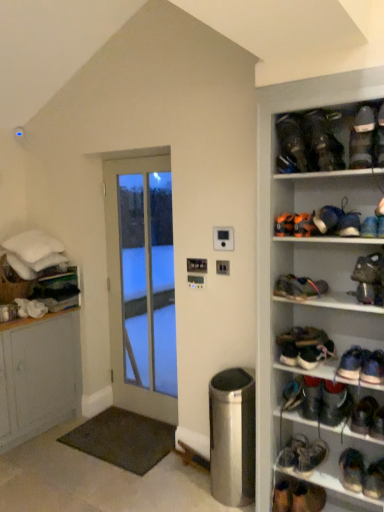
Find the location of a particular element. Image resolution: width=384 pixels, height=512 pixels. white soft cushion at left is located at coordinates (33, 246).

What do you see at coordinates (123, 439) in the screenshot? The width and height of the screenshot is (384, 512). I see `brown textured mat at lower left` at bounding box center [123, 439].

Where is `dark brown leather shoe at lower right, which is counted as the 20th footwear, starting from the top`? This screenshot has width=384, height=512. dark brown leather shoe at lower right, which is counted as the 20th footwear, starting from the top is located at coordinates (308, 498).

Is dark brown leather shoe at lower right, which is the 8th footwear in bottom-to-top order, located outside dark blue suede shoe at lower right, the 4th footwear when ordered from bottom to top?

dark brown leather shoe at lower right, which is the 8th footwear in bottom-to-top order, is positioned outside dark blue suede shoe at lower right, the 4th footwear when ordered from bottom to top.

From a real-world perspective, is dark brown leather shoe at lower right, which is counted as the 13th footwear, starting from the top, over dark blue suede shoe at lower right, the 4th footwear when ordered from bottom to top?

Yes, from a real-world perspective, dark brown leather shoe at lower right, which is counted as the 13th footwear, starting from the top, is on top of dark blue suede shoe at lower right, the 4th footwear when ordered from bottom to top.

Is dark brown leather shoe at lower right, which is the 8th footwear in bottom-to-top order, at the left side of dark blue suede shoe at lower right, which is the seventeenth footwear from top to bottom?

Indeed, dark brown leather shoe at lower right, which is the 8th footwear in bottom-to-top order, is positioned on the left side of dark blue suede shoe at lower right, which is the seventeenth footwear from top to bottom.

Where is `the 4th footwear in front when counting from the silver metallic trash can at center-right`? the 4th footwear in front when counting from the silver metallic trash can at center-right is located at coordinates (284, 225).

In the scene shown: From the image's perspective, is silver metallic trash can at center-right on orange suede shoe at upper right, acting as the seventeenth footwear starting from the bottom?

Incorrect, from the image's perspective, silver metallic trash can at center-right is lower than orange suede shoe at upper right, acting as the seventeenth footwear starting from the bottom.

From a real-world perspective, is silver metallic trash can at center-right beneath orange suede shoe at upper right, acting as the seventeenth footwear starting from the bottom?

Yes, from a real-world perspective, silver metallic trash can at center-right is beneath orange suede shoe at upper right, acting as the seventeenth footwear starting from the bottom.

From the image's perspective, is shiny metallic shoe at upper right, acting as the tenth footwear starting from the top, above or below shiny black shoe at lower right, the fifteenth footwear in the top-to-bottom sequence?

Clearly, from the image's perspective, shiny metallic shoe at upper right, acting as the tenth footwear starting from the top, is above shiny black shoe at lower right, the fifteenth footwear in the top-to-bottom sequence.

From a real-world perspective, is shiny metallic shoe at upper right, the eleventh footwear positioned from the bottom, physically below shiny black shoe at lower right, the fifteenth footwear in the top-to-bottom sequence?

Actually, shiny metallic shoe at upper right, the eleventh footwear positioned from the bottom, is physically above shiny black shoe at lower right, the fifteenth footwear in the top-to-bottom sequence, in the real world.

Which is in front, shiny metallic shoe at upper right, the eleventh footwear positioned from the bottom, or shiny black shoe at lower right, the fifteenth footwear in the top-to-bottom sequence?

shiny metallic shoe at upper right, the eleventh footwear positioned from the bottom, is closer to the camera.

How far apart are shiny metallic shoe at upper right, acting as the tenth footwear starting from the top, and shiny black shoe at lower right, the fifteenth footwear in the top-to-bottom sequence?

21.15 inches.

Does point (372, 497) come farther from viewer compared to point (324, 396)?

No, it is not.

Is matte black sneaker at lower right, which ranks as the second footwear in bottom-to-top order, bigger or smaller than dark brown leather shoe at lower right, which is the 8th footwear in bottom-to-top order?

In the image, matte black sneaker at lower right, which ranks as the second footwear in bottom-to-top order, appears to be smaller than dark brown leather shoe at lower right, which is the 8th footwear in bottom-to-top order.

The width and height of the screenshot is (384, 512). I want to click on the 6th footwear above the matte black sneaker at lower right, marked as the 19th footwear in a top-to-bottom arrangement (from the image's perspective), so click(x=334, y=403).

Considering the relative sizes of matte black sneaker at lower right, marked as the 19th footwear in a top-to-bottom arrangement, and dark brown leather shoe at lower right, which is the 8th footwear in bottom-to-top order, in the image provided, is matte black sneaker at lower right, marked as the 19th footwear in a top-to-bottom arrangement, taller than dark brown leather shoe at lower right, which is the 8th footwear in bottom-to-top order,?

No, matte black sneaker at lower right, marked as the 19th footwear in a top-to-bottom arrangement, is not taller than dark brown leather shoe at lower right, which is the 8th footwear in bottom-to-top order.

Is dark brown leather shoe at center right, marked as the 11th footwear in a top-to-bottom arrangement, bigger or smaller than dark brown leather shoes at upper right, the first footwear positioned from the top?

Considering their sizes, dark brown leather shoe at center right, marked as the 11th footwear in a top-to-bottom arrangement, takes up less space than dark brown leather shoes at upper right, the first footwear positioned from the top.

From a real-world perspective, between dark brown leather shoe at center right, the 10th footwear when ordered from bottom to top, and dark brown leather shoes at upper right, positioned as the 20th footwear in bottom-to-top order, who is vertically lower?

dark brown leather shoe at center right, the 10th footwear when ordered from bottom to top, is physically lower.

Is dark brown leather shoe at center right, marked as the 11th footwear in a top-to-bottom arrangement, to the left or to the right of dark brown leather shoes at upper right, positioned as the 20th footwear in bottom-to-top order, in the image?

dark brown leather shoe at center right, marked as the 11th footwear in a top-to-bottom arrangement, is positioned on dark brown leather shoes at upper right, positioned as the 20th footwear in bottom-to-top order,'s right side.

How much distance is there between dark brown leather shoe at center right, the 10th footwear when ordered from bottom to top, and dark brown leather shoes at upper right, the first footwear positioned from the top?

dark brown leather shoe at center right, the 10th footwear when ordered from bottom to top, and dark brown leather shoes at upper right, the first footwear positioned from the top, are 37.01 inches apart.

Is shiny black shoe at lower right, which is counted as the eighteenth footwear, starting from the top, oriented towards dark brown leather shoes at upper right, positioned as the 20th footwear in bottom-to-top order?

No, shiny black shoe at lower right, which is counted as the eighteenth footwear, starting from the top, is not facing towards dark brown leather shoes at upper right, positioned as the 20th footwear in bottom-to-top order.

Considering the positions of objects shiny black shoe at lower right, which is counted as the eighteenth footwear, starting from the top, and dark brown leather shoes at upper right, positioned as the 20th footwear in bottom-to-top order, in the image provided, who is more to the right, shiny black shoe at lower right, which is counted as the eighteenth footwear, starting from the top, or dark brown leather shoes at upper right, positioned as the 20th footwear in bottom-to-top order,?

shiny black shoe at lower right, which is counted as the eighteenth footwear, starting from the top.

Considering the positions of objects shiny black shoe at lower right, which is the 3th footwear in bottom-to-top order, and dark brown leather shoes at upper right, positioned as the 20th footwear in bottom-to-top order, in the image provided, who is in front, shiny black shoe at lower right, which is the 3th footwear in bottom-to-top order, or dark brown leather shoes at upper right, positioned as the 20th footwear in bottom-to-top order,?

dark brown leather shoes at upper right, positioned as the 20th footwear in bottom-to-top order.

What's the angular difference between shiny black shoe at lower right, which is counted as the eighteenth footwear, starting from the top, and dark brown leather shoes at upper right, the first footwear positioned from the top,'s facing directions?

9.13 degrees.

Measure the distance between shiny black shoe at lower right, which is counted as the eighteenth footwear, starting from the top, and blue suede shoe at upper right, the eighth footwear viewed from the top.

shiny black shoe at lower right, which is counted as the eighteenth footwear, starting from the top, is 3.90 feet from blue suede shoe at upper right, the eighth footwear viewed from the top.

Are shiny black shoe at lower right, which is counted as the eighteenth footwear, starting from the top, and blue suede shoe at upper right, the eighth footwear viewed from the top, beside each other?

They are not placed beside each other.

Image resolution: width=384 pixels, height=512 pixels. I want to click on the 13th footwear behind the blue suede shoe at upper right, the eighth footwear viewed from the top, so click(x=310, y=456).

From the picture: Can you confirm if shiny black shoe at lower right, which is counted as the eighteenth footwear, starting from the top, is wider than blue suede shoe at upper right, the eighth footwear viewed from the top?

Yes.

The width and height of the screenshot is (384, 512). In order to click on the 3rd footwear counting from the right side of the dark brown leather shoe at lower right, which is counted as the 13th footwear, starting from the top in this screenshot , I will do `click(352, 469)`.

Where is `trash bin/can on the left of orange suede shoe at upper right, acting as the seventeenth footwear starting from the bottom`? The height and width of the screenshot is (512, 384). trash bin/can on the left of orange suede shoe at upper right, acting as the seventeenth footwear starting from the bottom is located at coordinates (232, 437).

Looking at the image, which one is located closer to dark brown leather shoe at center right, the 10th footwear when ordered from bottom to top, multicolored fabric shoe at center right, which appears as the twelfth footwear when ordered from the bottom, or brown textured mat at lower left?

multicolored fabric shoe at center right, which appears as the twelfth footwear when ordered from the bottom, is closer to dark brown leather shoe at center right, the 10th footwear when ordered from bottom to top.

Looking at the image, which one is located closer to dark gray suede shoes at upper right, the nineteenth footwear when ordered from bottom to top, shiny black shoe at lower right, arranged as the sixth footwear when ordered from the bottom, or white soft cushion at left?

shiny black shoe at lower right, arranged as the sixth footwear when ordered from the bottom, is positioned closer to the anchor dark gray suede shoes at upper right, the nineteenth footwear when ordered from bottom to top.

When comparing their distances from blue suede sneakers at lower right, which is the 7th footwear in bottom-to-top order, does dark brown leather shoes at upper right, positioned as the 20th footwear in bottom-to-top order, or white soft cushion at left seem further?

white soft cushion at left lies further to blue suede sneakers at lower right, which is the 7th footwear in bottom-to-top order, than the other object.

When comparing their distances from orange suede shoe at upper right, which appears as the fourth footwear when viewed from the top, does shiny black shoe at lower right, which is counted as the eighteenth footwear, starting from the top, or blue suede sneakers at lower right, positioned as the 14th footwear in top-to-bottom order, seem further?

Based on the image, shiny black shoe at lower right, which is counted as the eighteenth footwear, starting from the top, appears to be further to orange suede shoe at upper right, which appears as the fourth footwear when viewed from the top.

From the image, which object appears to be nearer to white glass door at center, dark gray suede sneaker at upper right, which ranks as the eighteenth footwear in bottom-to-top order, or silver metallic trash can at center-right?

silver metallic trash can at center-right is closer to white glass door at center.

Estimate the real-world distances between objects in this image. Which object is further from shiny black shoe at lower right, which is counted as the eighteenth footwear, starting from the top, dark brown leather shoe at lower right, the first footwear positioned from the bottom, or shiny metallic shoe at upper right, acting as the tenth footwear starting from the top?

shiny metallic shoe at upper right, acting as the tenth footwear starting from the top.

Considering their positions, is shiny black shoe at right, the 5th footwear when ordered from bottom to top, positioned further to blue suede sneaker at upper right, the 6th footwear when ordered from top to bottom, than white soft cushion at left?

white soft cushion at left lies further to blue suede sneaker at upper right, the 6th footwear when ordered from top to bottom, than the other object.

Estimate the real-world distances between objects in this image. Which object is closer to silver metallic trash can at center-right, multicolored fabric shoe at center right, the ninth footwear when ordered from top to bottom, or dark brown leather shoe at lower right, the first footwear positioned from the bottom?

The object closer to silver metallic trash can at center-right is dark brown leather shoe at lower right, the first footwear positioned from the bottom.

In order to click on door between white soft cushion at left and blue suede sneaker at upper right, the fifteenth footwear in the bottom-to-top sequence in this screenshot , I will do [141, 285].

You are a GUI agent. You are given a task and a screenshot of the screen. Output one action in this format:
    pyautogui.click(x=<x>, y=<y>)
    Task: Click on the trash bin/can between blue suede shoe at upper right, acting as the 16th footwear starting from the bottom, and brown textured mat at lower left in the up-down direction
    The width and height of the screenshot is (384, 512).
    Given the screenshot: What is the action you would take?
    click(232, 437)

Find the location of a particular element. The height and width of the screenshot is (512, 384). door between orange suede shoe at upper right, which appears as the fourth footwear when viewed from the top, and shiny black shoe at lower right, which is the 3th footwear in bottom-to-top order, in the vertical direction is located at coordinates (141, 285).

I want to click on door between dark gray suede shoes at upper right, the second footwear from the top, and dark brown leather shoe at lower right, which is counted as the 20th footwear, starting from the top, in the vertical direction, so click(x=141, y=285).